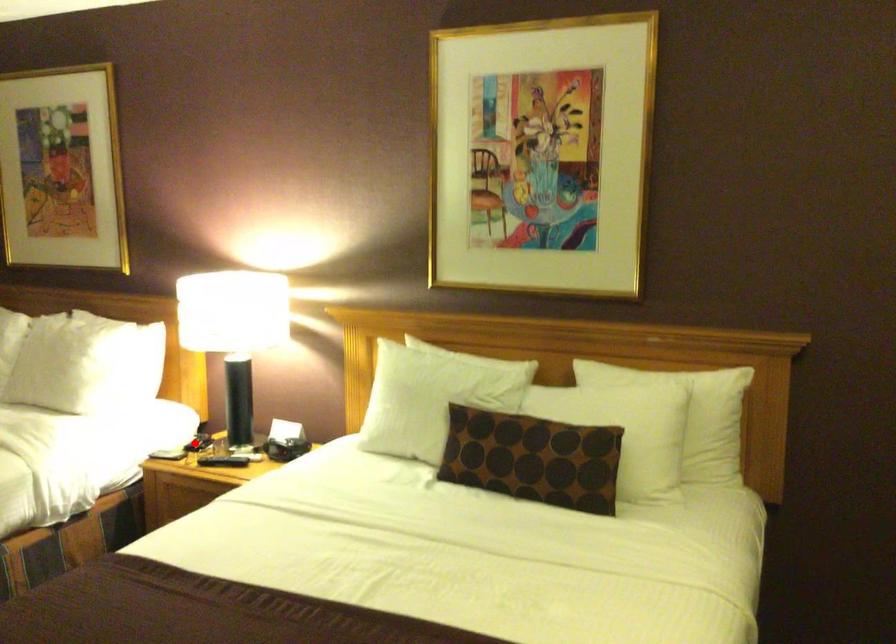
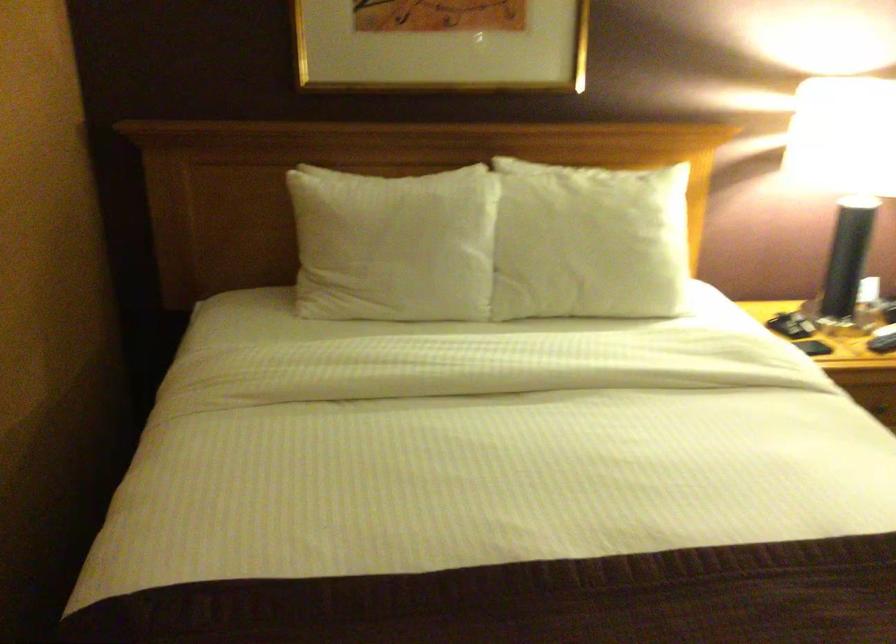
In the second image, find the point that corresponds to the highlighted location in the first image.

(782, 325)